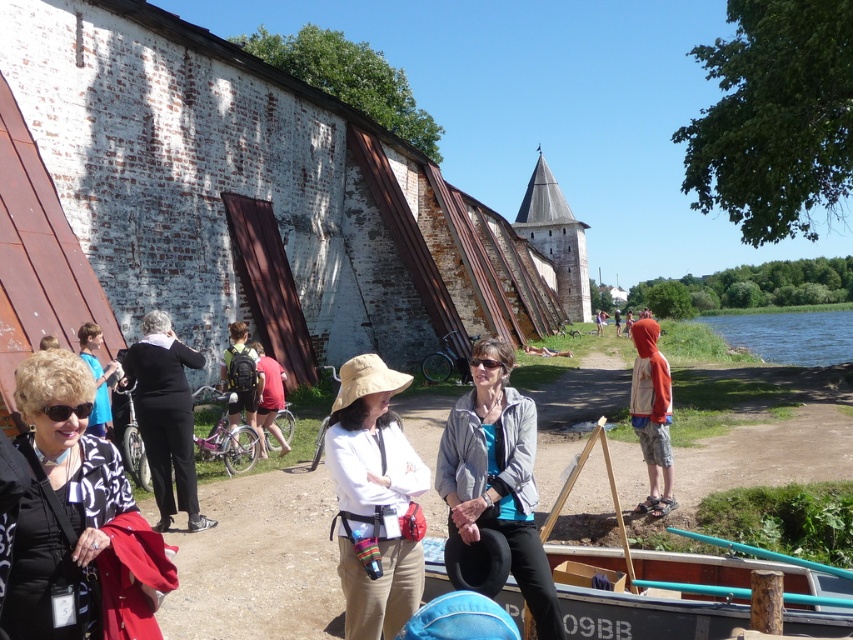
Question: Which object is closer to the camera taking this photo?

Choices:
 (A) wooden boat at lower center
 (B) black printed cardigan at lower left
 (C) gray fabric jacket at center
 (D) black matte pants at center

Answer: (B)

Question: Is wooden boat at lower center wider than black matte pants at center?

Choices:
 (A) yes
 (B) no

Answer: (A)

Question: In this image, where is black printed cardigan at lower left located relative to white cotton hat at center?

Choices:
 (A) below
 (B) above

Answer: (A)

Question: Does white cotton hat at center appear on the right side of wooden boat at lower center?

Choices:
 (A) no
 (B) yes

Answer: (A)

Question: Which point is closer to the camera taking this photo?

Choices:
 (A) (521, 458)
 (B) (22, 586)

Answer: (B)

Question: Estimate the real-world distances between objects in this image. Which object is farther from the black matte pants at center?

Choices:
 (A) black printed cardigan at lower left
 (B) white cotton hat at center
 (C) matte black jacket at lower left
 (D) gray fabric jacket at center

Answer: (D)